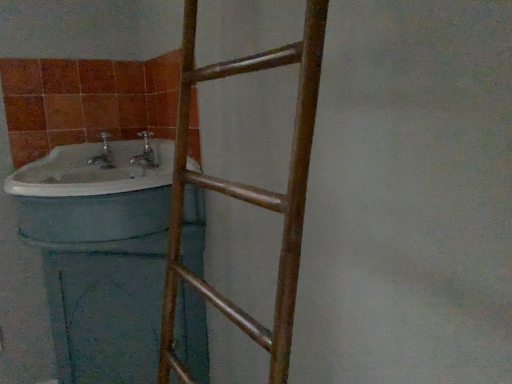
What do you see at coordinates (247, 191) in the screenshot?
I see `brown wooden ladder at center` at bounding box center [247, 191].

The width and height of the screenshot is (512, 384). I want to click on brown wooden ladder at center, so (247, 191).

What is the approximate width of white glossy sink at left?

white glossy sink at left is 48.44 centimeters wide.

What do you see at coordinates (94, 193) in the screenshot?
I see `white glossy sink at left` at bounding box center [94, 193].

Where is `white glossy sink at left`? This screenshot has height=384, width=512. white glossy sink at left is located at coordinates (94, 193).

Find the location of a particular element. This screenshot has width=512, height=384. brown wooden ladder at center is located at coordinates (247, 191).

Visually, is brown wooden ladder at center positioned to the left or to the right of white glossy sink at left?

In the image, brown wooden ladder at center appears on the right side of white glossy sink at left.

Based on the photo, which object is further away from the camera taking this photo, brown wooden ladder at center or white glossy sink at left?

white glossy sink at left is further from the camera.

Between point (298, 257) and point (166, 167), which one is positioned behind?

The point (166, 167) is farther from the camera.

From the picture: From the image's perspective, which one is positioned lower, brown wooden ladder at center or white glossy sink at left?

From the image's view, brown wooden ladder at center is below.

From a real-world perspective, between brown wooden ladder at center and white glossy sink at left, who is vertically lower?

From a 3D spatial view, brown wooden ladder at center is below.

Based on the photo, which object is wider, brown wooden ladder at center or white glossy sink at left?

Wider between the two is white glossy sink at left.

Does brown wooden ladder at center have a lesser height compared to white glossy sink at left?

In fact, brown wooden ladder at center may be taller than white glossy sink at left.

Considering the relative sizes of brown wooden ladder at center and white glossy sink at left in the image provided, is brown wooden ladder at center smaller than white glossy sink at left?

Actually, brown wooden ladder at center might be larger than white glossy sink at left.

Would you say white glossy sink at left is part of brown wooden ladder at center's contents?

No, white glossy sink at left is not surrounded by brown wooden ladder at center.

Is brown wooden ladder at center next to white glossy sink at left?

No, brown wooden ladder at center is not beside white glossy sink at left.

Is brown wooden ladder at center oriented towards white glossy sink at left?

No, brown wooden ladder at center does not turn towards white glossy sink at left.

What's the angular difference between brown wooden ladder at center and white glossy sink at left's facing directions?

brown wooden ladder at center and white glossy sink at left are facing 0.000413 degrees away from each other.

Where is `sink lying above the brown wooden ladder at center (from the image's perspective)`? sink lying above the brown wooden ladder at center (from the image's perspective) is located at coordinates (94, 193).

Considering the relative positions of white glossy sink at left and brown wooden ladder at center in the image provided, is white glossy sink at left to the right of brown wooden ladder at center from the viewer's perspective?

No, white glossy sink at left is not to the right of brown wooden ladder at center.

Between white glossy sink at left and brown wooden ladder at center, which one is positioned behind?

white glossy sink at left.

Which is less distant, (138, 167) or (178, 243)?

Point (138, 167).

From the image's perspective, is white glossy sink at left located above brown wooden ladder at center?

Correct, white glossy sink at left appears higher than brown wooden ladder at center in the image.

From a real-world perspective, which is physically below, white glossy sink at left or brown wooden ladder at center?

From a 3D spatial view, brown wooden ladder at center is below.

Between white glossy sink at left and brown wooden ladder at center, which one has smaller width?

With smaller width is brown wooden ladder at center.

Between white glossy sink at left and brown wooden ladder at center, which one has more height?

brown wooden ladder at center.

Does white glossy sink at left have a smaller size compared to brown wooden ladder at center?

Yes.

Is brown wooden ladder at center surrounded by white glossy sink at left?

No.

Is white glossy sink at left positioned far away from brown wooden ladder at center?

No.

In the scene shown: Is white glossy sink at left looking in the opposite direction of brown wooden ladder at center?

That's not correct — white glossy sink at left is not looking away from brown wooden ladder at center.

You are a GUI agent. You are given a task and a screenshot of the screen. Output one action in this format:
    pyautogui.click(x=<x>, y=<y>)
    Task: Click on the sink above the brown wooden ladder at center (from the image's perspective)
    The width and height of the screenshot is (512, 384).
    Given the screenshot: What is the action you would take?
    tap(94, 193)

In order to click on ladder directly beneath the white glossy sink at left (from a real-world perspective) in this screenshot , I will do `click(247, 191)`.

Image resolution: width=512 pixels, height=384 pixels. Identify the location of ladder on the right of white glossy sink at left. (247, 191).